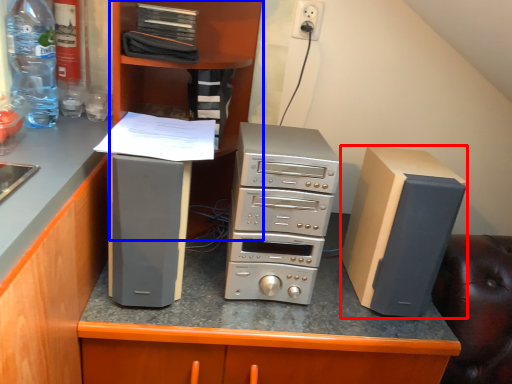
Question: Which object is closer to the camera taking this photo, computer tower (highlighted by a red box) or bookshelf (highlighted by a blue box)?

Choices:
 (A) computer tower
 (B) bookshelf

Answer: (B)